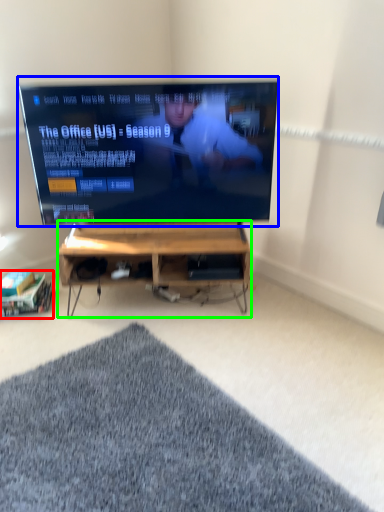
Question: Estimate the real-world distances between objects in this image. Which object is farther from shelf (highlighted by a red box), television (highlighted by a blue box) or desk (highlighted by a green box)?

Choices:
 (A) television
 (B) desk

Answer: (A)